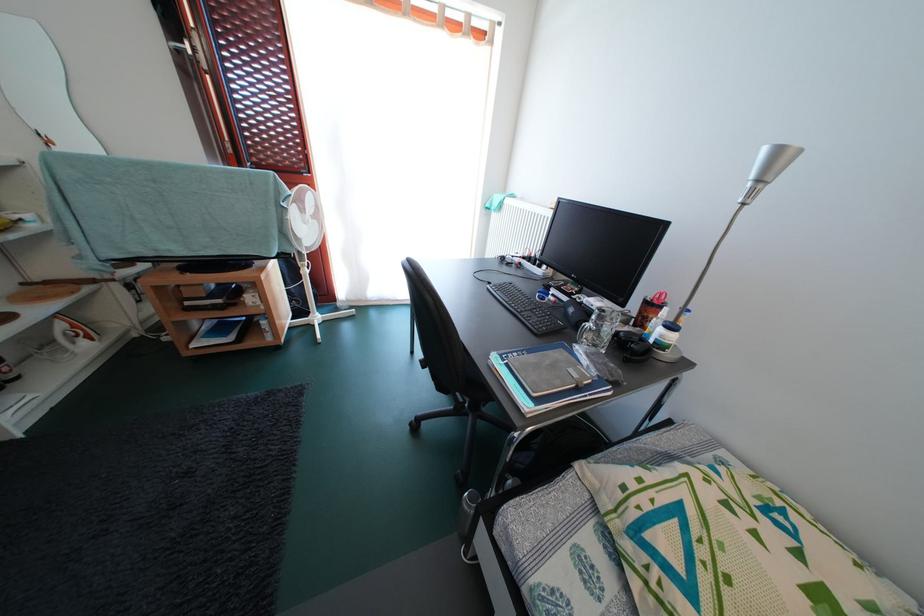
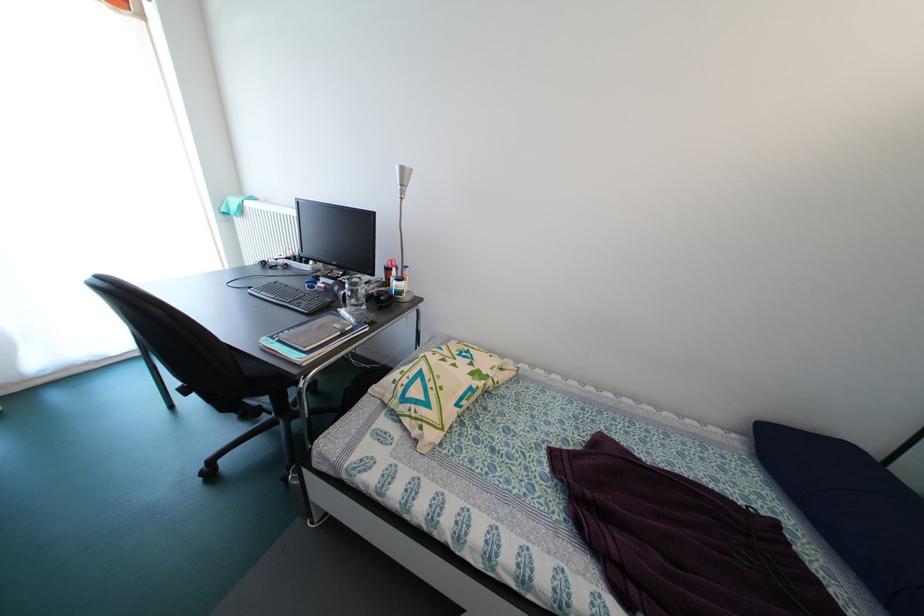
In the second image, find the point that corresponds to point 578,315 in the first image.

(344, 294)